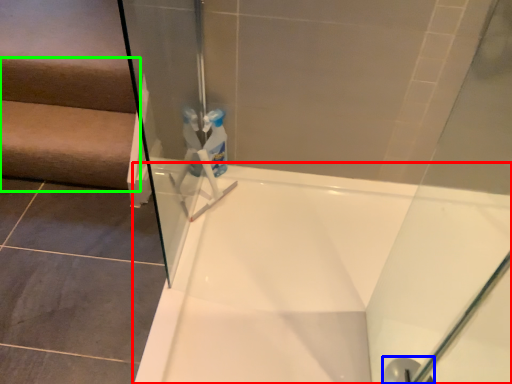
Question: Which is farther away from bathtub (highlighted by a red box)? shower (highlighted by a blue box) or stairwell (highlighted by a green box)?

Choices:
 (A) shower
 (B) stairwell

Answer: (B)